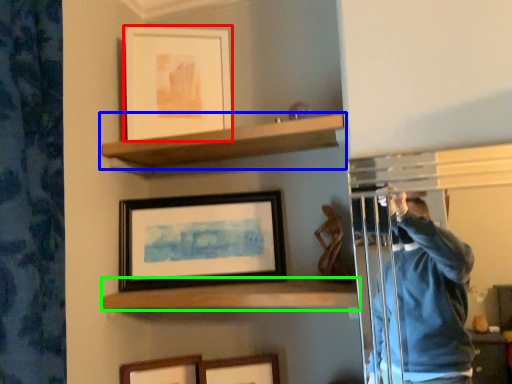
Question: Which object is positioned closest to picture frame (highlighted by a red box)? Select from shelf (highlighted by a blue box) and shelf (highlighted by a green box).

Choices:
 (A) shelf
 (B) shelf

Answer: (A)